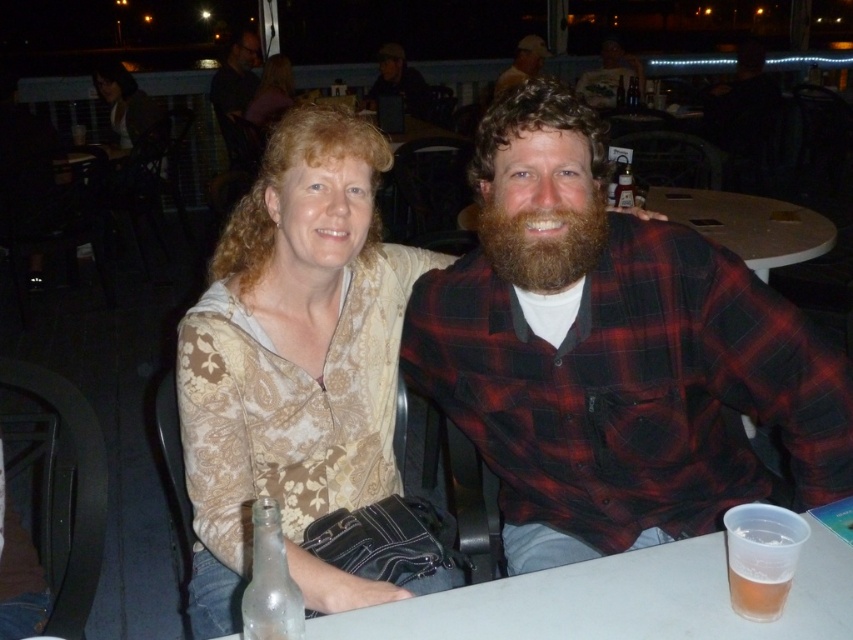
You are a bartender who needs to decide which item to use for a drink. The matte white cap at upper center and the clear glass bottle at center are both on the table. Which one is bigger?

The matte white cap at upper center is larger in size than the clear glass bottle at center, so the matte white cap at upper center is bigger.

You are a waiter at this outdoor table. You need to deliver a drink to the man on the right. Which object should you pick up first, the matte white cap at upper center or the clear glass bottle at center, to ensure you reach him without spilling?

You should pick up the clear glass bottle at center first because the matte white cap at upper center is positioned to its left, so moving the bottle first would avoid knocking over the cap.

You are a photographer trying to capture a closeup of the beige floral blouse at center and the dark brown hair at upper left. Which object should you focus on first to ensure it appears sharp in the photo?

The beige floral blouse at center is closer to the viewer than the dark brown hair at upper left, so you should focus on the beige floral blouse at center first to ensure it appears sharp.